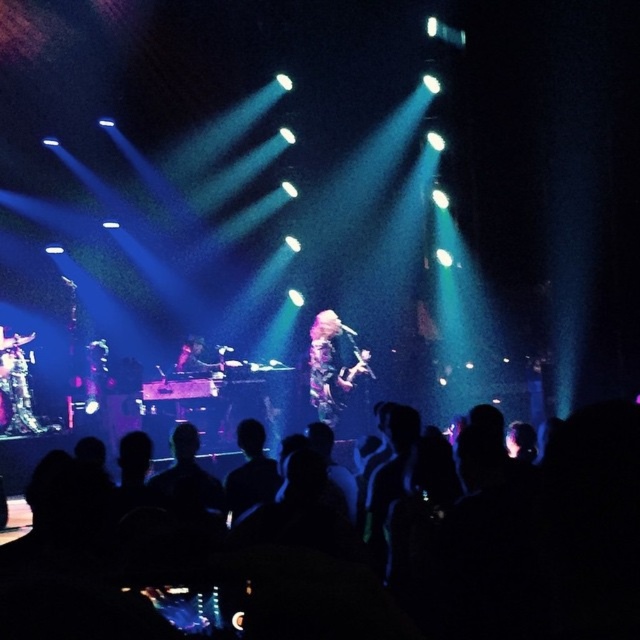
You are a photographer trying to capture the audience members in the black silhouettes at lower center. According to the coordinates provided, where should you aim your camera to ensure the silhouettes are centered in the photo?

The black silhouettes at lower center are located at coordinates point [554,540], so you should aim your camera at that point to center them in the photo.